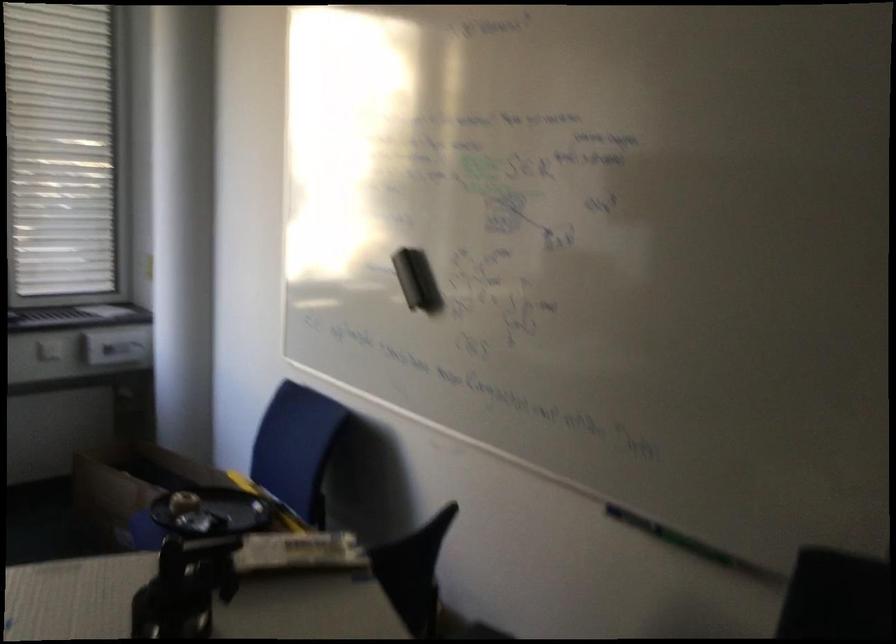
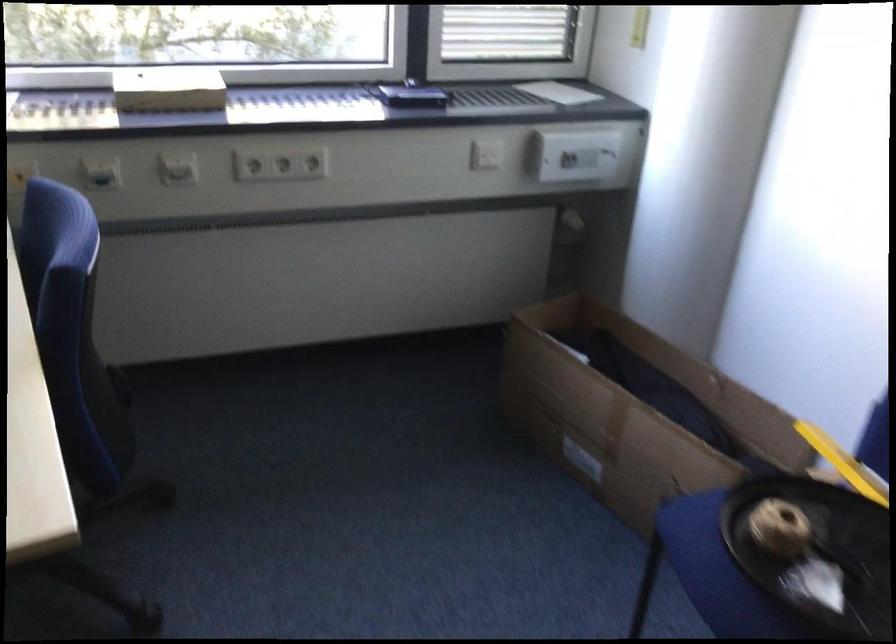
Looking at this image, the images are taken continuously from a first-person perspective. In which direction are you moving?

The cameraman walked toward left, forward.